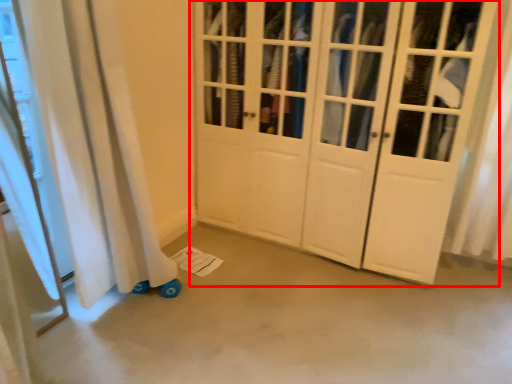
Question: Considering the relative positions of door (annotated by the red box) and concrete in the image provided, where is door (annotated by the red box) located with respect to the staircase?

Choices:
 (A) left
 (B) right

Answer: (B)